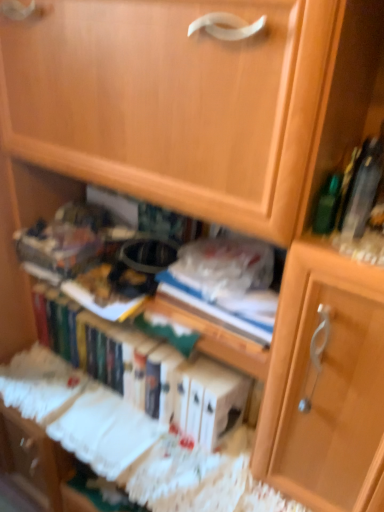
What do you see at coordinates (86, 339) in the screenshot? The image size is (384, 512). I see `white matte book at center` at bounding box center [86, 339].

Measure the distance between white matte book at center and camera.

The distance of white matte book at center from camera is 3.39 feet.

Identify the location of white matte book at center. The image size is (384, 512). (86, 339).

What are the coordinates of `white matte book at center` in the screenshot? It's located at (86, 339).